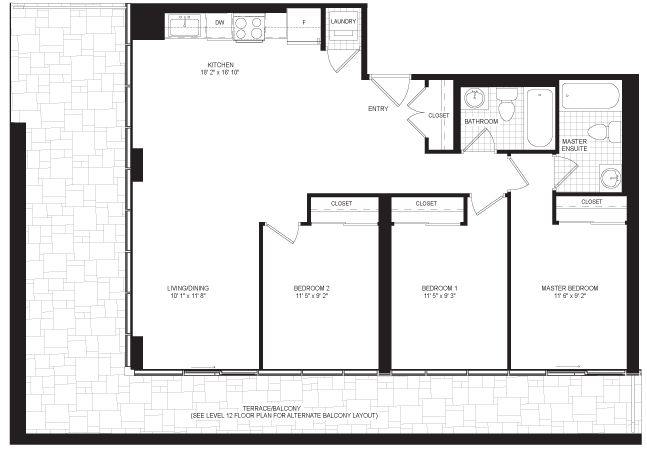
Locate an element on the screen. This screenshot has height=458, width=647. kitchen area is located at coordinates (239, 144).